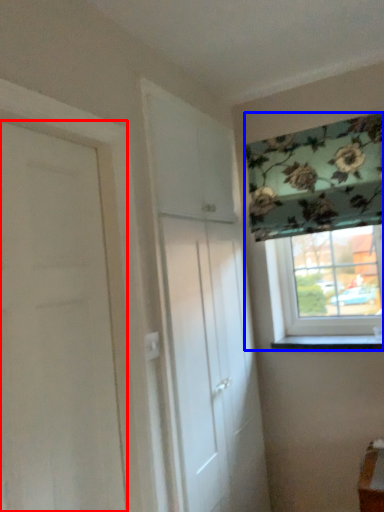
Question: Which object is further to the camera taking this photo, door (highlighted by a red box) or window (highlighted by a blue box)?

Choices:
 (A) door
 (B) window

Answer: (B)